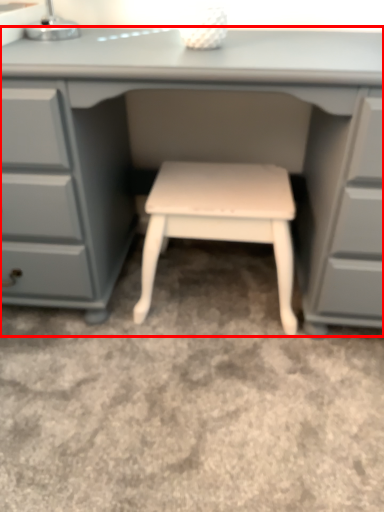
Question: From the image's perspective, considering the relative positions of desk (annotated by the red box) and stool in the image provided, where is desk (annotated by the red box) located with respect to the staircase?

Choices:
 (A) below
 (B) above

Answer: (B)